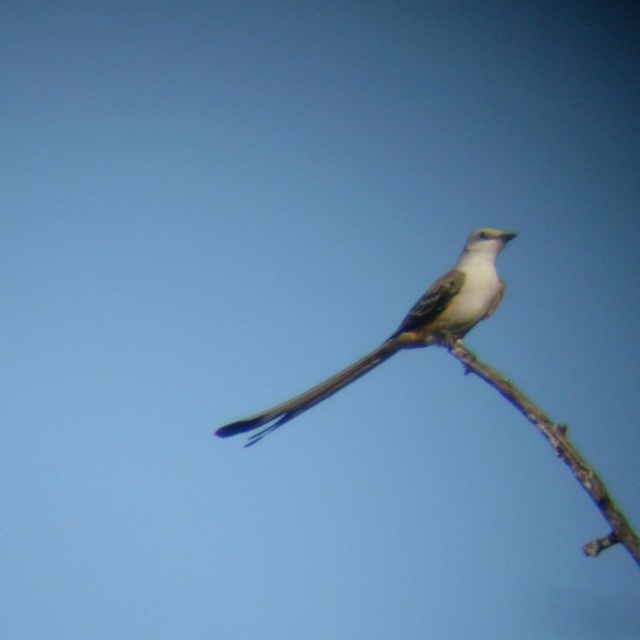
Between point (330, 376) and point (545, 424), which one is positioned behind?

The point (330, 376) is behind.

Who is taller, white matte bird at center or brown rough tree branch at right?

With more height is white matte bird at center.

This screenshot has height=640, width=640. Identify the location of white matte bird at center. (410, 326).

Is white matte bird at center to the left of silvery metallic tail at center from the viewer's perspective?

No, white matte bird at center is not to the left of silvery metallic tail at center.

Can you confirm if white matte bird at center is bigger than silvery metallic tail at center?

Yes, white matte bird at center is bigger than silvery metallic tail at center.

What do you see at coordinates (410, 326) in the screenshot?
I see `white matte bird at center` at bounding box center [410, 326].

I want to click on white matte bird at center, so click(x=410, y=326).

Is point (552, 440) farther from camera compared to point (291, 400)?

No, it is in front of (291, 400).

Is point (636, 536) positioned in front of point (276, 406)?

Yes, point (636, 536) is in front of point (276, 406).

The width and height of the screenshot is (640, 640). Find the location of `brown rough tree branch at right`. brown rough tree branch at right is located at coordinates (556, 451).